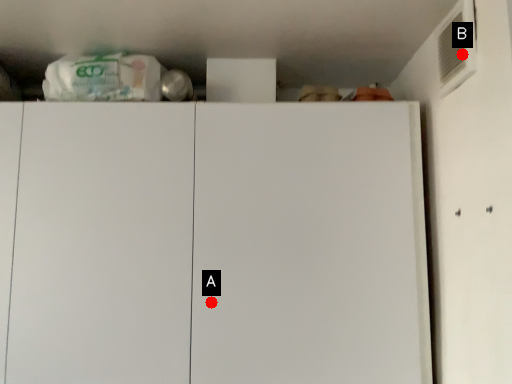
Question: Two points are circled on the image, labeled by A and B beside each circle. Which of the following is the farthest from the observer?

Choices:
 (A) A is further
 (B) B is further

Answer: (A)